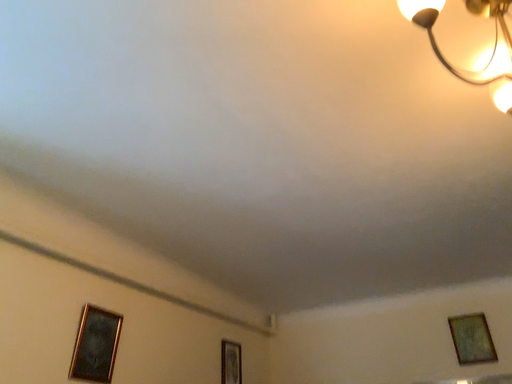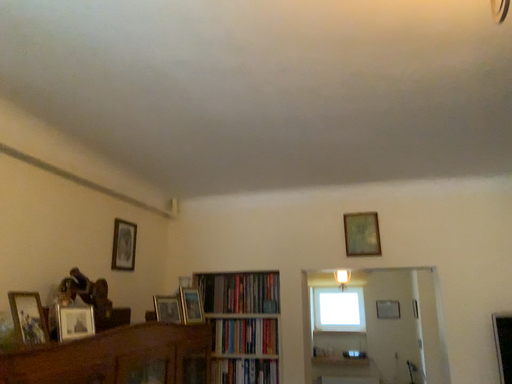
Question: How did the camera likely rotate when shooting the video?

Choices:
 (A) rotated left
 (B) rotated right

Answer: (B)